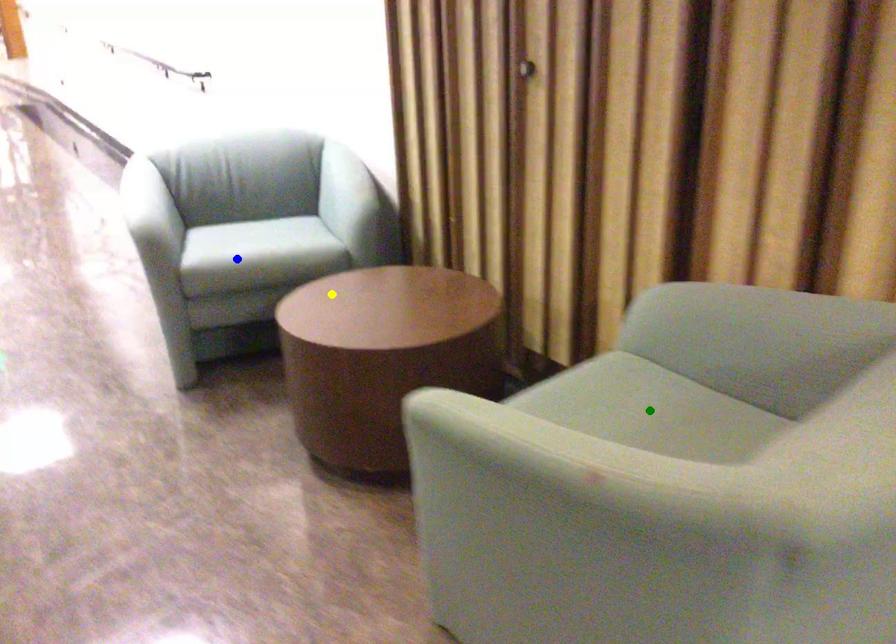
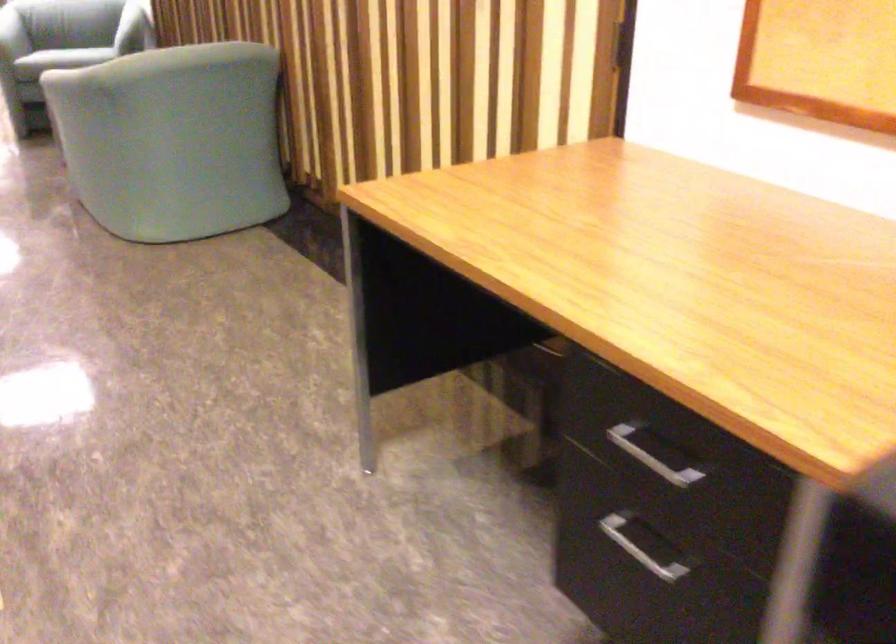
I am providing you with two images of the same scene from different viewpoints. Three points are marked in image1. Which point corresponds to a part or object that is occluded in image2?In image1, three points are marked. Which of them correspond to a part or object that is occluded in image2?Among the three points shown in image1, which one corresponds to a part or object that is no longer visible due to occlusion in image2?

green point